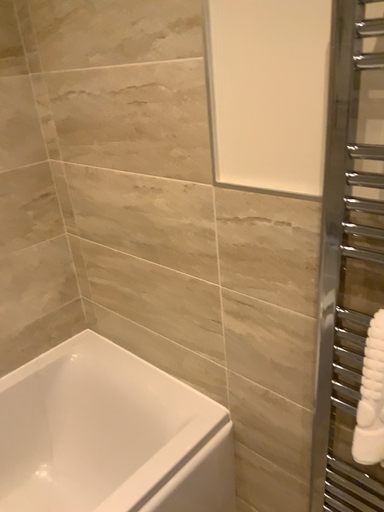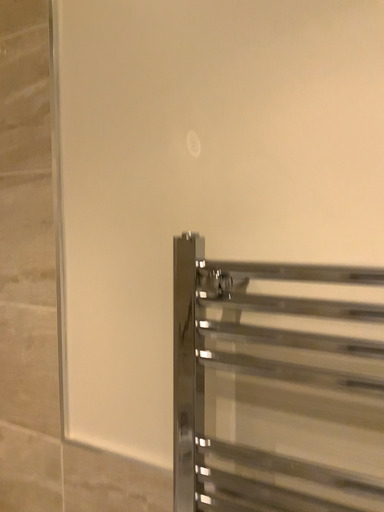
Question: Which way did the camera rotate in the video?

Choices:
 (A) rotated upward
 (B) rotated downward

Answer: (A)